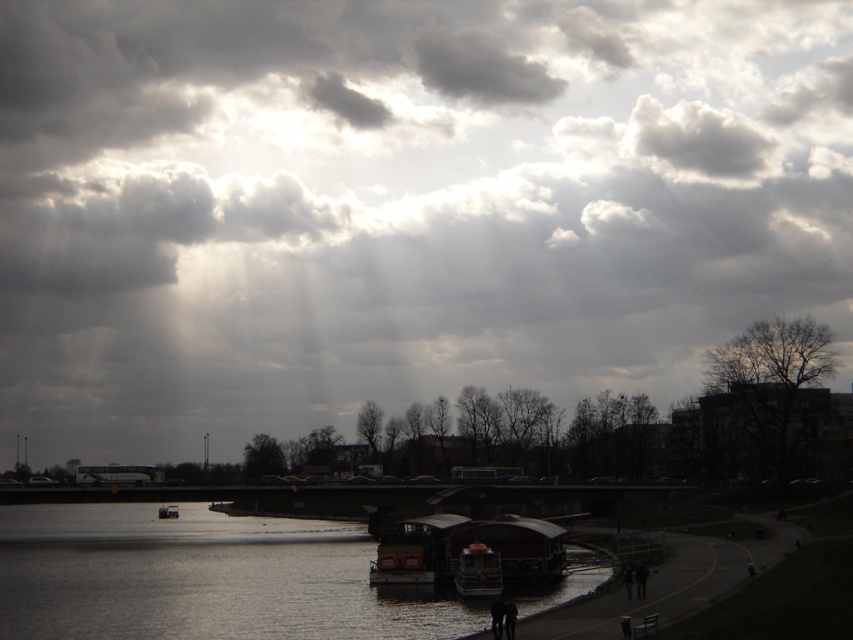
Question: Which of these objects is positioned closest to the silvery reflective water at lower center?

Choices:
 (A) metallic orange lifeboat at lower center
 (B) cloudy sky at upper center

Answer: (A)

Question: Among these points, which one is nearest to the camera?

Choices:
 (A) (189, 616)
 (B) (1, 216)

Answer: (A)

Question: Does metallic orange lifeboat at lower center have a smaller size compared to wooden boat at center?

Choices:
 (A) yes
 (B) no

Answer: (A)

Question: Where is silvery reflective water at lower center located in relation to wooden boat at center in the image?

Choices:
 (A) left
 (B) right

Answer: (B)

Question: Among these points, which one is nearest to the camera?

Choices:
 (A) (38, 184)
 (B) (469, 545)
 (C) (0, 636)
 (D) (160, 515)

Answer: (C)

Question: In this image, where is cloudy sky at upper center located relative to wooden boat at center?

Choices:
 (A) right
 (B) left

Answer: (A)